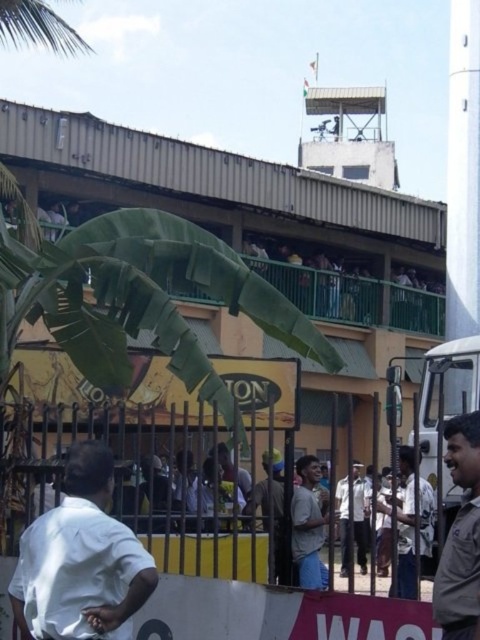
Question: Does white cotton shirt at center appear on the right side of light brown shirt at center?

Choices:
 (A) no
 (B) yes

Answer: (B)

Question: Is light gray shirt at center below dark gray shirt at center?

Choices:
 (A) yes
 (B) no

Answer: (A)

Question: Where is light gray shirt at center located in relation to light brown shirt at center in the image?

Choices:
 (A) above
 (B) below

Answer: (A)

Question: Which of the following is the farthest from the observer?

Choices:
 (A) white cotton shirt at center
 (B) light brown shirt at center
 (C) brown leather jacket at lower right

Answer: (B)

Question: Which of these objects is positioned farthest from the dark gray shirt at center?

Choices:
 (A) brown leather jacket at lower right
 (B) light brown shirt at center
 (C) light gray shirt at center
 (D) white matte shirt at lower left

Answer: (A)

Question: Which of the following is the farthest from the observer?

Choices:
 (A) (308, 566)
 (B) (399, 496)

Answer: (B)